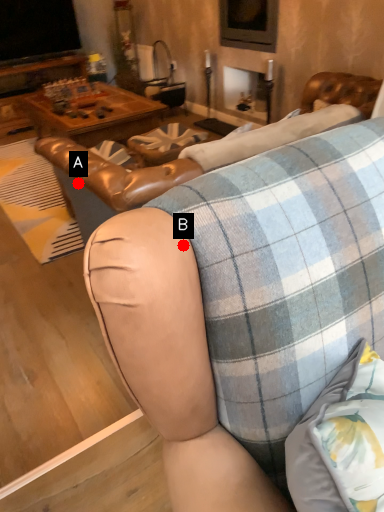
Question: Two points are circled on the image, labeled by A and B beside each circle. Which point appears farthest from the camera in this image?

Choices:
 (A) A is further
 (B) B is further

Answer: (A)